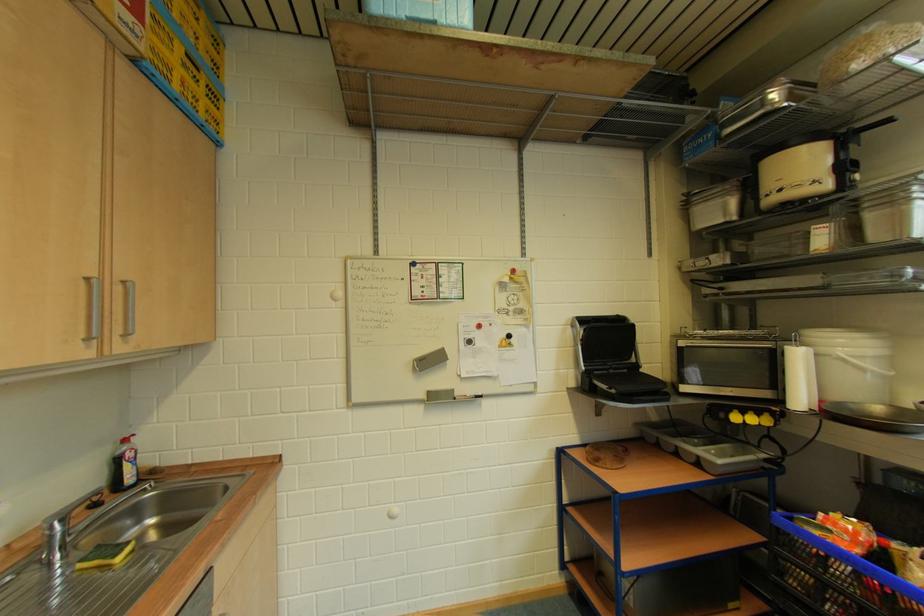
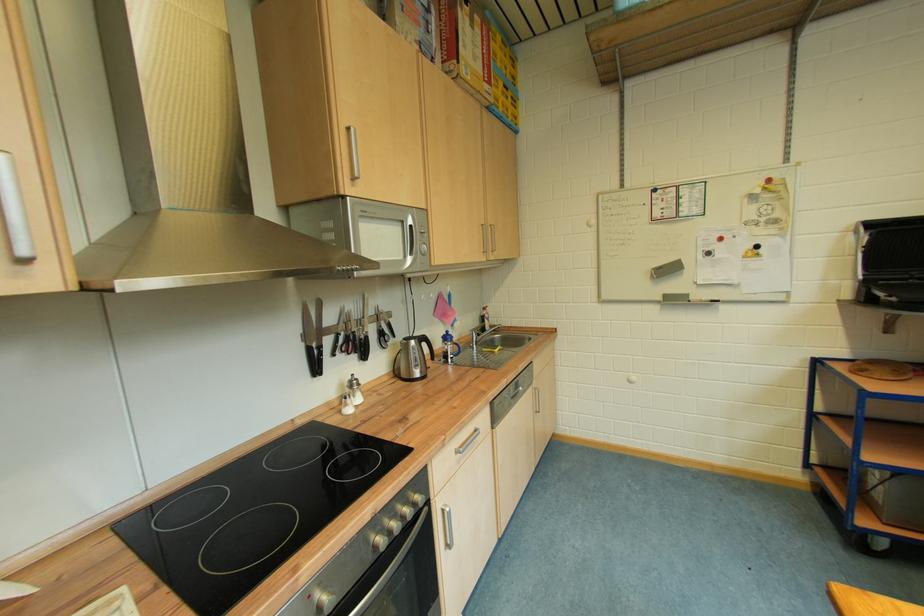
Locate, in the second image, the point that corresponds to pixel 94 282 in the first image.

(490, 228)